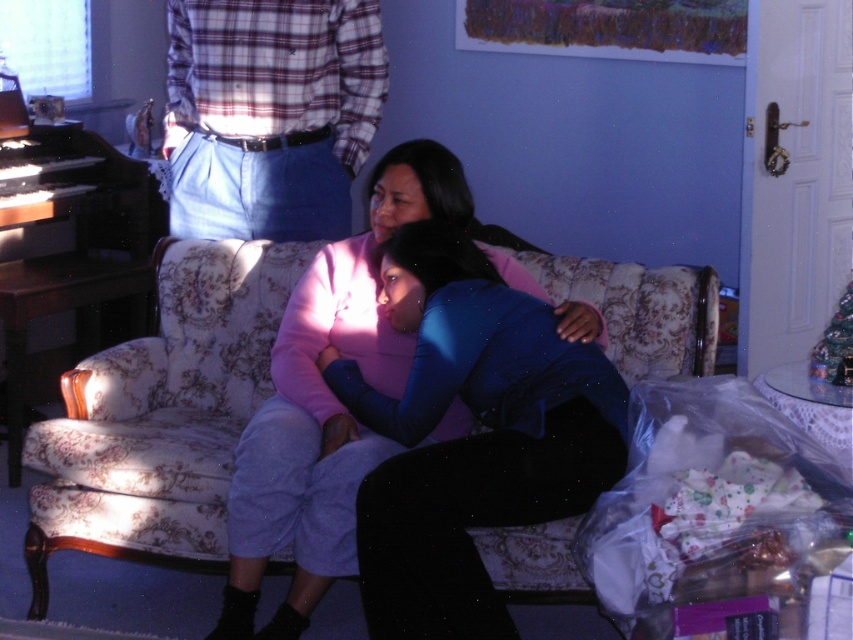
You are an interior designer assessing the layout of the room. You need to place a new lamp on the floral fabric couch at center so that it is above the blue matte shirt at center. Is this possible given their current positions?

The floral fabric couch at center is located below blue matte shirt at center, so placing the lamp on the couch above the blue matte shirt at center is not possible since the couch is already positioned below it.

From the picture: You are a delivery person trying to place a small package between the floral fabric couch at center and the plaid fabric shirt at upper center. Can you fit the package if it measures 18 inches in length?

The distance between the floral fabric couch at center and the plaid fabric shirt at upper center is 20.73 inches. Since the package is 18 inches long, there is enough space to fit it between them.